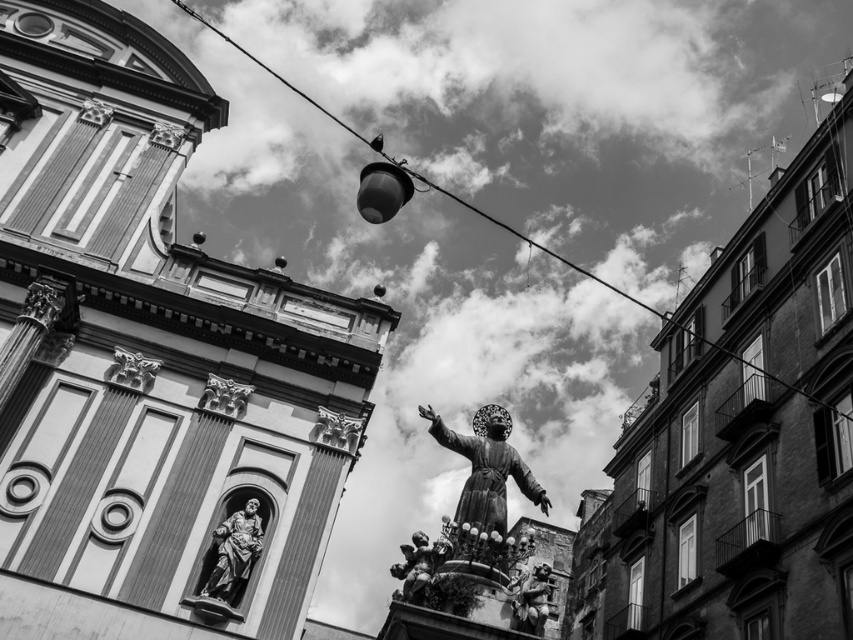
Between polished bronze statue at center and polished stone carving at center, which one has less height?

polished stone carving at center is shorter.

Is polished bronze statue at center above polished stone carving at center?

Actually, polished bronze statue at center is below polished stone carving at center.

Is point (480, 438) less distant than point (344, 436)?

Yes, it is.

Locate an element on the screen. polished bronze statue at center is located at coordinates (485, 472).

Is metallic wire at upper center in front of polished stone carving at center?

Yes.

Describe the element at coordinates (535, 243) in the screenshot. I see `metallic wire at upper center` at that location.

This screenshot has width=853, height=640. Identify the location of metallic wire at upper center. (535, 243).

Is polished bronze statue at center further to camera compared to polished stone relief at upper center?

No, polished bronze statue at center is in front of polished stone relief at upper center.

Find the location of a particular element. This screenshot has width=853, height=640. polished bronze statue at center is located at coordinates (485, 472).

At what (x,y) coordinates should I click in order to perform the action: click on polished bronze statue at center. Please return your answer as a coordinate pair (x, y). Image resolution: width=853 pixels, height=640 pixels. Looking at the image, I should click on click(485, 472).